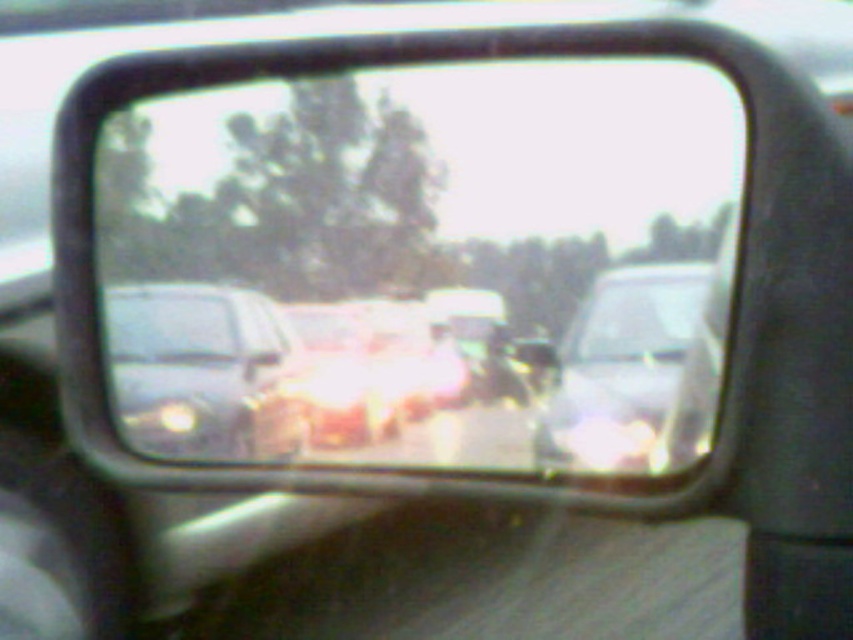
Which of these two, clear glass mirror at center or satin silver sedan at center, stands taller?

With more height is clear glass mirror at center.

Does clear glass mirror at center appear under satin silver sedan at center?

No.

Between point (155, 138) and point (689, 388), which one is positioned behind?

Point (155, 138)

The width and height of the screenshot is (853, 640). I want to click on clear glass mirror at center, so click(x=415, y=260).

Is satin silver sedan at left further to camera compared to satin silver sedan at center?

Yes, satin silver sedan at left is behind satin silver sedan at center.

Does satin silver sedan at left have a larger size compared to satin silver sedan at center?

Yes.

Who is more forward, (142, 333) or (683, 317)?

Point (683, 317)

Locate an element on the screen. The height and width of the screenshot is (640, 853). satin silver sedan at left is located at coordinates (202, 371).

Which of these two, clear glass mirror at center or satin silver sedan at left, stands shorter?

A: With less height is satin silver sedan at left.

Does clear glass mirror at center have a greater width compared to satin silver sedan at left?

Yes.

Locate an element on the screen. clear glass mirror at center is located at coordinates (415, 260).

Locate an element on the screen. The height and width of the screenshot is (640, 853). clear glass mirror at center is located at coordinates (415, 260).